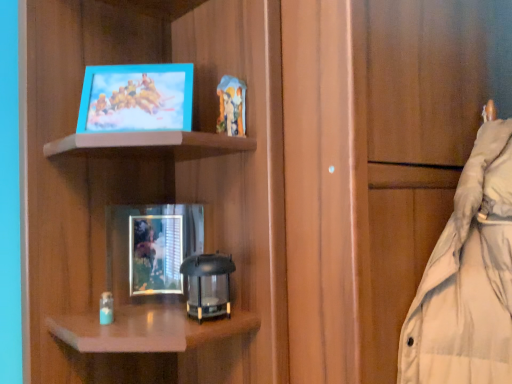
Describe the element at coordinates (376, 163) in the screenshot. I see `matte wood cabinet at center` at that location.

Find the location of a particular element. This screenshot has width=512, height=384. metallic silver picture frame at center, which is the 1th picture frame in bottom-to-top order is located at coordinates (150, 247).

Image resolution: width=512 pixels, height=384 pixels. Find the location of `matte wood cabinet at center`. matte wood cabinet at center is located at coordinates point(376,163).

Relative to matte wood cabinet at center, is metallic silver picture frame at center, which is the 2th picture frame from front to back, in front or behind?

In the image, metallic silver picture frame at center, which is the 2th picture frame from front to back, appears behind matte wood cabinet at center.

From a real-world perspective, does metallic silver picture frame at center, the 1th picture frame viewed from the back, stand above matte wood cabinet at center?

Actually, metallic silver picture frame at center, the 1th picture frame viewed from the back, is physically below matte wood cabinet at center in the real world.

From the image's perspective, between metallic silver picture frame at center, which is the second picture frame in top-to-bottom order, and matte wood cabinet at center, which one is located above?

From the image's view, matte wood cabinet at center is above.

The image size is (512, 384). I want to click on cabinetry located in front of the metallic silver picture frame at center, which is the second picture frame in top-to-bottom order, so pyautogui.click(x=376, y=163).

From the image's perspective, is matte blue picture frame at upper left, which is counted as the 1th picture frame, starting from the top, above metallic silver picture frame at center, which is the 2th picture frame from front to back?

Indeed, from the image's perspective, matte blue picture frame at upper left, which is counted as the 1th picture frame, starting from the top, is shown above metallic silver picture frame at center, which is the 2th picture frame from front to back.

Which is more to the left, matte blue picture frame at upper left, positioned as the 2th picture frame in bottom-to-top order, or metallic silver picture frame at center, which is the second picture frame in top-to-bottom order?

Positioned to the left is matte blue picture frame at upper left, positioned as the 2th picture frame in bottom-to-top order.

Is the depth of matte blue picture frame at upper left, positioned as the 2th picture frame in bottom-to-top order, greater than that of metallic silver picture frame at center, the 1th picture frame viewed from the back?

No, it is not.

Are matte blue picture frame at upper left, positioned as the 2th picture frame in bottom-to-top order, and metallic silver picture frame at center, which is the second picture frame in top-to-bottom order, making contact?

No, matte blue picture frame at upper left, positioned as the 2th picture frame in bottom-to-top order, is not making contact with metallic silver picture frame at center, which is the second picture frame in top-to-bottom order.

In the scene shown: Between matte wood cabinet at center and matte blue picture frame at upper left, positioned as the 2th picture frame in bottom-to-top order, which one has smaller size?

Smaller between the two is matte blue picture frame at upper left, positioned as the 2th picture frame in bottom-to-top order.

Which object is thinner, matte wood cabinet at center or matte blue picture frame at upper left, the second picture frame positioned from the back?

With smaller width is matte blue picture frame at upper left, the second picture frame positioned from the back.

Measure the distance from matte blue picture frame at upper left, positioned as the 2th picture frame in bottom-to-top order, to matte wood cabinet at center.

A distance of 14.27 inches exists between matte blue picture frame at upper left, positioned as the 2th picture frame in bottom-to-top order, and matte wood cabinet at center.

In order to click on picture frame located above the matte wood cabinet at center (from a real-world perspective) in this screenshot , I will do `click(136, 98)`.

Is matte blue picture frame at upper left, which is counted as the 1th picture frame, starting from the top, to the left of matte wood cabinet at center from the viewer's perspective?

Yes, matte blue picture frame at upper left, which is counted as the 1th picture frame, starting from the top, is to the left of matte wood cabinet at center.

Which object is closer to the camera, matte blue picture frame at upper left, the second picture frame positioned from the back, or matte wood cabinet at center?

matte wood cabinet at center is closer to the camera.

Would you say metallic silver picture frame at center, which is the 1th picture frame in bottom-to-top order, is to the left or to the right of matte blue picture frame at upper left, the second picture frame positioned from the back, in the picture?

metallic silver picture frame at center, which is the 1th picture frame in bottom-to-top order, is positioned on matte blue picture frame at upper left, the second picture frame positioned from the back,'s right side.

Can you see metallic silver picture frame at center, which is the second picture frame in top-to-bottom order, touching matte blue picture frame at upper left, which is counted as the 1th picture frame, starting from the top?

No, metallic silver picture frame at center, which is the second picture frame in top-to-bottom order, is not with matte blue picture frame at upper left, which is counted as the 1th picture frame, starting from the top.

Is metallic silver picture frame at center, the 1th picture frame viewed from the back, oriented towards matte blue picture frame at upper left, the second picture frame positioned from the back?

No.

Considering the sizes of metallic silver picture frame at center, which is the 2th picture frame from front to back, and matte blue picture frame at upper left, the second picture frame positioned from the back, in the image, is metallic silver picture frame at center, which is the 2th picture frame from front to back, wider or thinner than matte blue picture frame at upper left, the second picture frame positioned from the back,?

metallic silver picture frame at center, which is the 2th picture frame from front to back, is thinner than matte blue picture frame at upper left, the second picture frame positioned from the back.

What's the angular difference between matte wood cabinet at center and metallic silver picture frame at center, which is the 2th picture frame from front to back,'s facing directions?

33.7 degrees separate the facing orientations of matte wood cabinet at center and metallic silver picture frame at center, which is the 2th picture frame from front to back.

The width and height of the screenshot is (512, 384). I want to click on cabinetry above the metallic silver picture frame at center, which is the 1th picture frame in bottom-to-top order (from a real-world perspective), so click(x=376, y=163).

From the image's perspective, which object appears higher, matte wood cabinet at center or metallic silver picture frame at center, which is the second picture frame in top-to-bottom order?

matte wood cabinet at center appears higher in the image.

Choose the correct answer: Is matte wood cabinet at center inside metallic silver picture frame at center, the 1th picture frame viewed from the back, or outside it?

matte wood cabinet at center is outside metallic silver picture frame at center, the 1th picture frame viewed from the back.

Find the location of a particular element. cabinetry above the metallic silver picture frame at center, the 1th picture frame viewed from the back (from a real-world perspective) is located at coordinates (376, 163).

At what (x,y) coordinates should I click in order to perform the action: click on picture frame in front of the metallic silver picture frame at center, which is the second picture frame in top-to-bottom order. Please return your answer as a coordinate pair (x, y). Image resolution: width=512 pixels, height=384 pixels. Looking at the image, I should click on (136, 98).

Looking at the image, which one is located closer to matte wood cabinet at center, metallic silver picture frame at center, which is the 1th picture frame in bottom-to-top order, or matte blue picture frame at upper left, positioned as the 2th picture frame in bottom-to-top order?

Based on the image, matte blue picture frame at upper left, positioned as the 2th picture frame in bottom-to-top order, appears to be nearer to matte wood cabinet at center.

Looking at this image, when comparing their distances from matte blue picture frame at upper left, positioned as the 2th picture frame in bottom-to-top order, does metallic silver picture frame at center, which is the 1th picture frame in bottom-to-top order, or matte wood cabinet at center seem closer?

metallic silver picture frame at center, which is the 1th picture frame in bottom-to-top order, is closer to matte blue picture frame at upper left, positioned as the 2th picture frame in bottom-to-top order.

Looking at this image, from the image, which object appears to be nearer to metallic silver picture frame at center, which is the 2th picture frame from front to back, matte blue picture frame at upper left, positioned as the 2th picture frame in bottom-to-top order, or matte wood cabinet at center?

matte blue picture frame at upper left, positioned as the 2th picture frame in bottom-to-top order, is closer to metallic silver picture frame at center, which is the 2th picture frame from front to back.

Looking at the image, which one is located closer to metallic silver picture frame at center, the 1th picture frame viewed from the back, matte wood cabinet at center or matte blue picture frame at upper left, marked as the 1th picture frame in a front-to-back arrangement?

matte blue picture frame at upper left, marked as the 1th picture frame in a front-to-back arrangement, lies closer to metallic silver picture frame at center, the 1th picture frame viewed from the back, than the other object.

From the image, which object appears to be nearer to matte wood cabinet at center, matte blue picture frame at upper left, positioned as the 2th picture frame in bottom-to-top order, or metallic silver picture frame at center, which is the 2th picture frame from front to back?

Among the two, matte blue picture frame at upper left, positioned as the 2th picture frame in bottom-to-top order, is located nearer to matte wood cabinet at center.

Looking at the image, which one is located further to matte blue picture frame at upper left, positioned as the 2th picture frame in bottom-to-top order, matte wood cabinet at center or metallic silver picture frame at center, which is the 2th picture frame from front to back?

matte wood cabinet at center lies further to matte blue picture frame at upper left, positioned as the 2th picture frame in bottom-to-top order, than the other object.

Where is `picture frame between matte blue picture frame at upper left, positioned as the 2th picture frame in bottom-to-top order, and matte wood cabinet at center`? This screenshot has height=384, width=512. picture frame between matte blue picture frame at upper left, positioned as the 2th picture frame in bottom-to-top order, and matte wood cabinet at center is located at coordinates (150, 247).